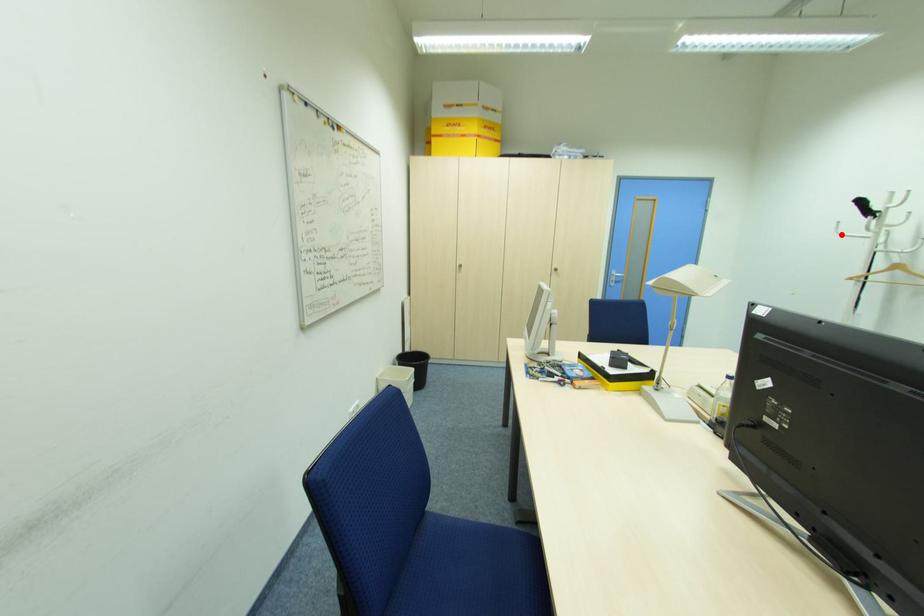
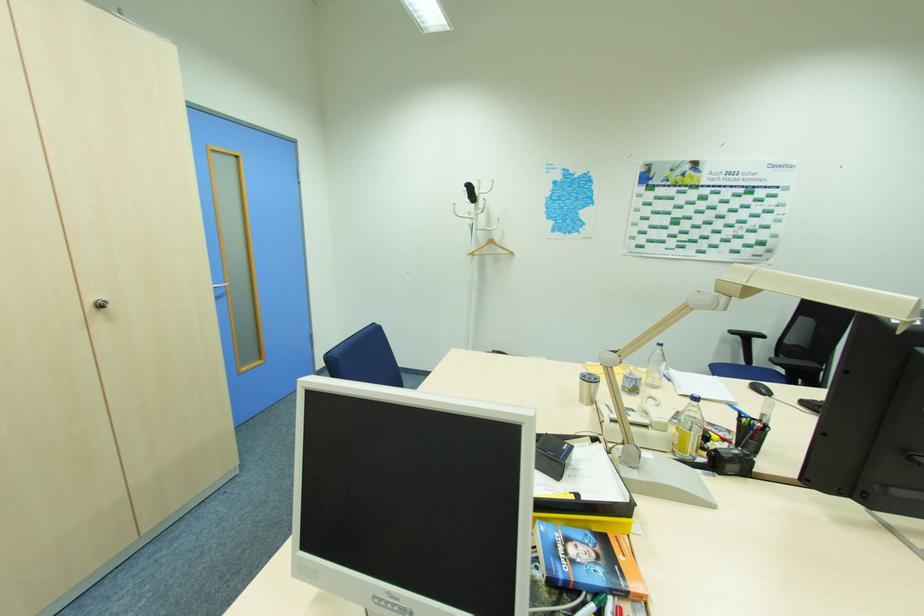
Question: I am providing you with two images of the same scene from different viewpoints. A red point is shown in image1. For the corresponding object point in image2, is it positioned nearer or farther from the camera?

Choices:
 (A) Nearer
 (B) Farther

Answer: (A)